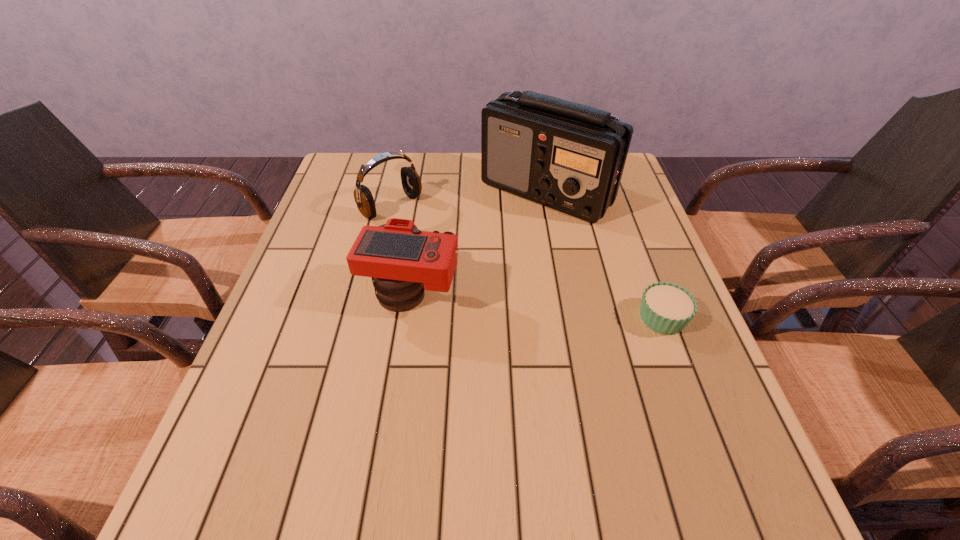
Where is `free space on the desktop that is between the camera and the shortest object and is positioned on the ear cups of the headset`? This screenshot has width=960, height=540. free space on the desktop that is between the camera and the shortest object and is positioned on the ear cups of the headset is located at coordinates (511, 303).

The image size is (960, 540). In order to click on vacant space on the desktop that is between the camera and the cupcake and is positioned on the front panel of the tallest object in this screenshot , I will do `click(551, 307)`.